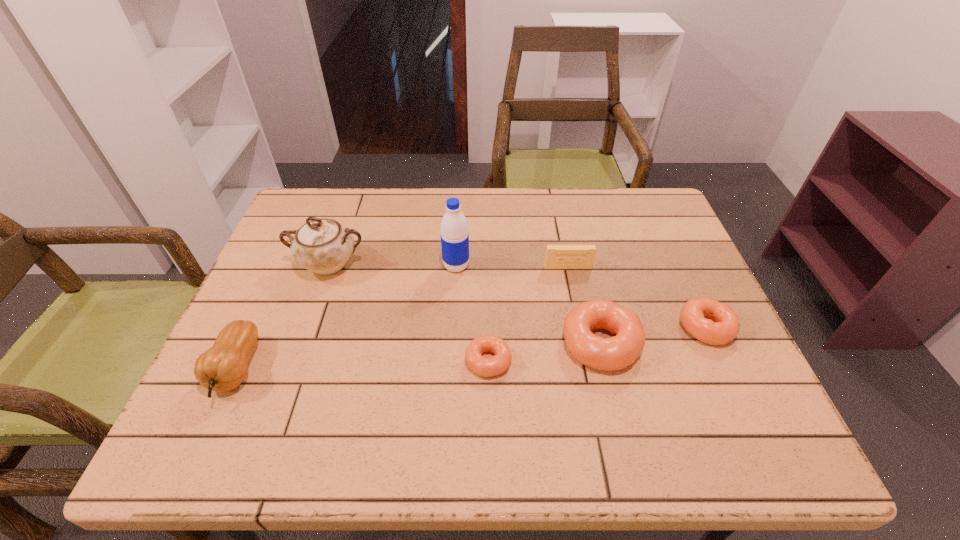
I want to click on the shortest doughnut, so click(x=486, y=367).

At what (x,y) coordinates should I click in order to perform the action: click on the leftmost doughnut. Please return your answer as a coordinate pair (x, y). Looking at the image, I should click on (486, 367).

The width and height of the screenshot is (960, 540). I want to click on the second doughnut from right to left, so click(607, 354).

At what (x,y) coordinates should I click in order to perform the action: click on the rightmost object. Please return your answer as a coordinate pair (x, y). The height and width of the screenshot is (540, 960). Looking at the image, I should click on tap(723, 325).

Identify the location of the second shortest object. (723, 325).

Find the location of a particular element. The height and width of the screenshot is (540, 960). water bottle is located at coordinates (454, 234).

The width and height of the screenshot is (960, 540). I want to click on chinaware, so click(323, 246).

You are a GUI agent. You are given a task and a screenshot of the screen. Output one action in this format:
    pyautogui.click(x=<x>, y=<y>)
    Task: Click on the videotape
    This screenshot has height=540, width=960.
    Given the screenshot: What is the action you would take?
    pyautogui.click(x=557, y=256)

Locate an element on the screen. Image resolution: width=960 pixels, height=540 pixels. the fifth shortest object is located at coordinates (223, 367).

At what (x,y) coordinates should I click in order to perform the action: click on free location located 0.190m on the back of the shortest doughnut. Please return your answer as a coordinate pair (x, y). The width and height of the screenshot is (960, 540). Looking at the image, I should click on (487, 282).